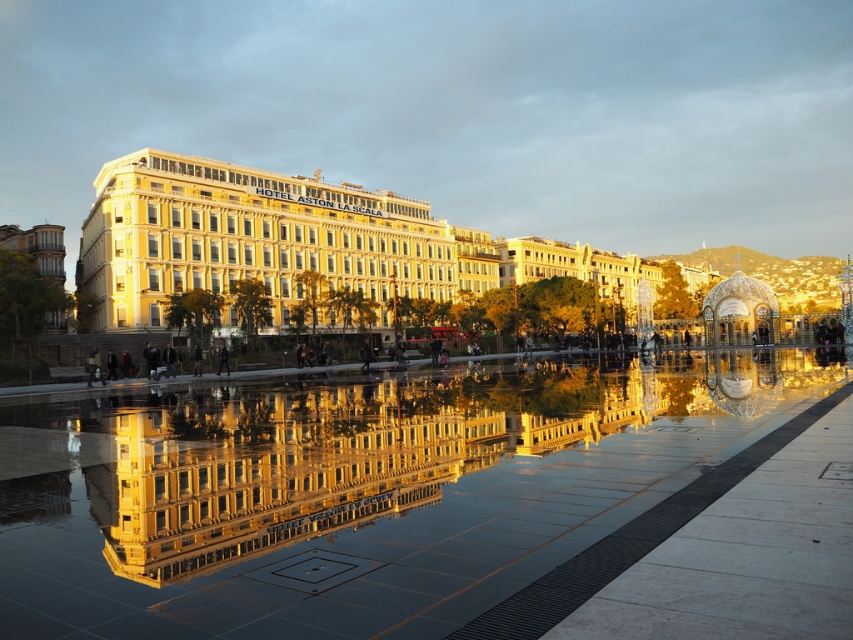
Consider the image. You are standing at the point with coordinates 0.5,0.5 in the image. You want to walk to the glossy reflective water at center. In which direction should you move?

The glossy reflective water at center is located at point (363, 490). Since you are at (426, 320), you should move towards the right and slightly downward to reach it.

You are standing in front of the HOTEL ASTON LA SCALA and want to take a photo of both the glossy reflective water at center and the golden stone building at center. Which object should you position to your left to capture both in the frame?

You should position the glossy reflective water at center to your left since it is on the left side of the golden stone building at center, allowing both objects to be captured in the frame.